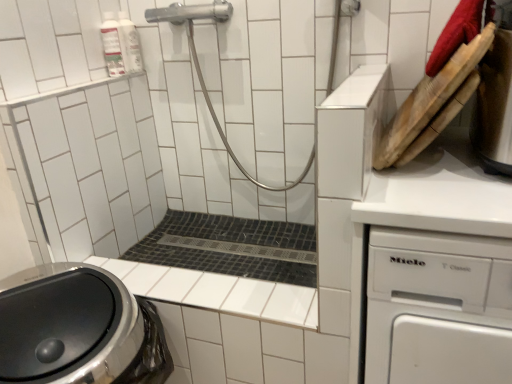
Question: Is stainless steel kettle at upper right shorter than white plastic dishwasher at right?

Choices:
 (A) no
 (B) yes

Answer: (B)

Question: Is stainless steel kettle at upper right facing away from white plastic dishwasher at right?

Choices:
 (A) no
 (B) yes

Answer: (A)

Question: From the image's perspective, is stainless steel kettle at upper right under white plastic dishwasher at right?

Choices:
 (A) no
 (B) yes

Answer: (A)

Question: Does stainless steel kettle at upper right have a smaller size compared to white plastic dishwasher at right?

Choices:
 (A) yes
 (B) no

Answer: (A)

Question: Is stainless steel kettle at upper right in contact with white plastic dishwasher at right?

Choices:
 (A) yes
 (B) no

Answer: (B)

Question: Is black mosaic tile bath at center in front of or behind stainless steel kettle at upper right in the image?

Choices:
 (A) front
 (B) behind

Answer: (B)

Question: From the image's perspective, is black mosaic tile bath at center located above or below stainless steel kettle at upper right?

Choices:
 (A) above
 (B) below

Answer: (B)

Question: Looking at the image, does black mosaic tile bath at center seem bigger or smaller compared to stainless steel kettle at upper right?

Choices:
 (A) small
 (B) big

Answer: (B)

Question: Is black mosaic tile bath at center inside the boundaries of stainless steel kettle at upper right, or outside?

Choices:
 (A) inside
 (B) outside

Answer: (B)

Question: Considering their positions, is stainless steel washing machine at lower left located in front of or behind black mosaic tile bath at center?

Choices:
 (A) behind
 (B) front

Answer: (B)

Question: From a real-world perspective, is stainless steel washing machine at lower left physically located above or below black mosaic tile bath at center?

Choices:
 (A) below
 (B) above

Answer: (A)

Question: Considering the relative positions of stainless steel washing machine at lower left and black mosaic tile bath at center in the image provided, is stainless steel washing machine at lower left to the left or to the right of black mosaic tile bath at center?

Choices:
 (A) right
 (B) left

Answer: (B)

Question: From the image's perspective, is stainless steel washing machine at lower left above or below black mosaic tile bath at center?

Choices:
 (A) below
 (B) above

Answer: (A)

Question: From the image's perspective, is stainless steel kettle at upper right above or below black mosaic tile bath at center?

Choices:
 (A) above
 (B) below

Answer: (A)

Question: From a real-world perspective, is stainless steel kettle at upper right above or below black mosaic tile bath at center?

Choices:
 (A) below
 (B) above

Answer: (B)